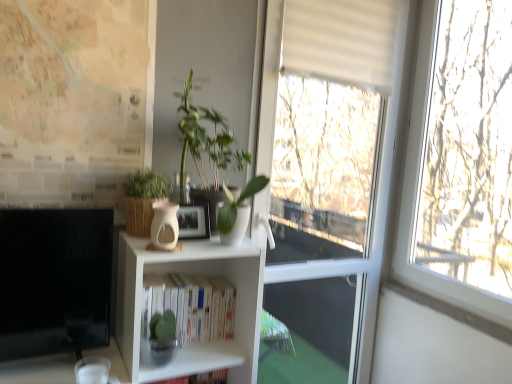
This screenshot has width=512, height=384. Identify the location of black glossy tv at left. (54, 280).

What is the approximate height of black glossy tv at left?

black glossy tv at left is 48.29 centimeters tall.

Measure the distance between matte beige vase at center and camera.

The distance of matte beige vase at center from camera is 1.21 meters.

Locate an element on the screen. This screenshot has height=384, width=512. matte beige vase at center is located at coordinates (164, 226).

What do you see at coordinates (214, 155) in the screenshot?
I see `green glossy plant at center, the first houseplant from the right` at bounding box center [214, 155].

Find the location of a particular element. The width and height of the screenshot is (512, 384). green glossy plant at center, which appears as the second houseplant when viewed from the left is located at coordinates (214, 155).

This screenshot has width=512, height=384. I want to click on white matte bookshelf at center, so click(x=191, y=305).

The image size is (512, 384). What do you see at coordinates (143, 199) in the screenshot? I see `brown woven basket at center, marked as the 2th houseplant in a right-to-left arrangement` at bounding box center [143, 199].

Identify the location of black glossy tv at left. The image size is (512, 384). (54, 280).

Consider the image. Is black glossy tv at left shorter than green glossy plant at center, the first houseplant from the right?

No, black glossy tv at left is not shorter than green glossy plant at center, the first houseplant from the right.

From the image's perspective, is black glossy tv at left located beneath green glossy plant at center, which appears as the second houseplant when viewed from the left?

Correct, black glossy tv at left appears lower than green glossy plant at center, which appears as the second houseplant when viewed from the left, in the image.

Does point (89, 221) appear closer or farther from the camera than point (210, 118)?

Clearly, point (89, 221) is closer to the camera than point (210, 118).

Considering the sizes of objects black glossy tv at left and green glossy plant at center, the first houseplant from the right, in the image provided, who is bigger, black glossy tv at left or green glossy plant at center, the first houseplant from the right,?

green glossy plant at center, the first houseplant from the right.

From the image's perspective, is brown woven basket at center, placed as the 1th houseplant when sorted from left to right, above or below matte beige vase at center?

Based on their image positions, brown woven basket at center, placed as the 1th houseplant when sorted from left to right, is located above matte beige vase at center.

Does brown woven basket at center, placed as the 1th houseplant when sorted from left to right, come behind matte beige vase at center?

Yes.

From a real-world perspective, does brown woven basket at center, placed as the 1th houseplant when sorted from left to right, sit lower than matte beige vase at center?

Incorrect, from a real-world perspective, brown woven basket at center, placed as the 1th houseplant when sorted from left to right, is higher than matte beige vase at center.

Can you confirm if brown woven basket at center, placed as the 1th houseplant when sorted from left to right, is positioned to the right of matte beige vase at center?

In fact, brown woven basket at center, placed as the 1th houseplant when sorted from left to right, is to the left of matte beige vase at center.

Which is farther from the camera, (137, 192) or (231, 202)?

The point (137, 192) is farther from the camera.

Considering the relative sizes of brown woven basket at center, marked as the 2th houseplant in a right-to-left arrangement, and white glossy vase at center, which is the second plant in left-to-right order, in the image provided, is brown woven basket at center, marked as the 2th houseplant in a right-to-left arrangement, smaller than white glossy vase at center, which is the second plant in left-to-right order,?

Incorrect, brown woven basket at center, marked as the 2th houseplant in a right-to-left arrangement, is not smaller in size than white glossy vase at center, which is the second plant in left-to-right order.

Could you tell me if green leafy plant at center, arranged as the second plant when viewed from the right, is facing white glossy vase at center, which is the second plant in left-to-right order?

No, green leafy plant at center, arranged as the second plant when viewed from the right, is not turned towards white glossy vase at center, which is the second plant in left-to-right order.

Between green leafy plant at center, which is the first plant from left to right, and white glossy vase at center, which is the first plant from right to left, which one has more height?

green leafy plant at center, which is the first plant from left to right, is taller.

In terms of width, does green leafy plant at center, which is the first plant from left to right, look wider or thinner when compared to white glossy vase at center, which is the first plant from right to left?

Considering their sizes, green leafy plant at center, which is the first plant from left to right, looks broader than white glossy vase at center, which is the first plant from right to left.

Does point (188, 90) appear closer or farther from the camera than point (231, 198)?

Point (188, 90) is closer to the camera than point (231, 198).

Can you confirm if brown woven basket at center, marked as the 2th houseplant in a right-to-left arrangement, is shorter than white matte bookshelf at center?

Correct, brown woven basket at center, marked as the 2th houseplant in a right-to-left arrangement, is not as tall as white matte bookshelf at center.

From a real-world perspective, who is located higher, brown woven basket at center, marked as the 2th houseplant in a right-to-left arrangement, or white matte bookshelf at center?

In real-world perspective, brown woven basket at center, marked as the 2th houseplant in a right-to-left arrangement, is above.

Considering the sizes of objects brown woven basket at center, marked as the 2th houseplant in a right-to-left arrangement, and white matte bookshelf at center in the image provided, who is wider, brown woven basket at center, marked as the 2th houseplant in a right-to-left arrangement, or white matte bookshelf at center?

brown woven basket at center, marked as the 2th houseplant in a right-to-left arrangement.

Does point (144, 218) lie in front of point (189, 275)?

Yes, point (144, 218) is in front of point (189, 275).

Considering the relative sizes of white matte window at center and white glossy vase at center, which is the first plant from right to left, in the image provided, is white matte window at center smaller than white glossy vase at center, which is the first plant from right to left,?

No, white matte window at center is not smaller than white glossy vase at center, which is the first plant from right to left.

Find the location of a particular element. The width and height of the screenshot is (512, 384). window lying on the right of white glossy vase at center, which is the first plant from right to left is located at coordinates (x=328, y=177).

Is there a large distance between white matte window at center and white glossy vase at center, which is the first plant from right to left?

white matte window at center is far away from white glossy vase at center, which is the first plant from right to left.

Is black glossy tv at left far from green leafy plant at center, arranged as the second plant when viewed from the right?

No, black glossy tv at left is in close proximity to green leafy plant at center, arranged as the second plant when viewed from the right.

What's the angular difference between black glossy tv at left and green leafy plant at center, which is the first plant from left to right,'s facing directions?

4.77 degrees.

Who is smaller, black glossy tv at left or green leafy plant at center, which is the first plant from left to right?

Smaller between the two is green leafy plant at center, which is the first plant from left to right.

You are a GUI agent. You are given a task and a screenshot of the screen. Output one action in this format:
    pyautogui.click(x=<x>, y=<y>)
    Task: Click on the window screen on the left side of green glossy plant at center, the first houseplant from the right
    
    Given the screenshot: What is the action you would take?
    pyautogui.click(x=54, y=280)

There is a matte beige vase at center. Where is `the 1st houseplant above it (from a real-world perspective)`? Image resolution: width=512 pixels, height=384 pixels. the 1st houseplant above it (from a real-world perspective) is located at coordinates (143, 199).

Which object lies further to the anchor point green leafy plant at center, arranged as the second plant when viewed from the right, white matte window at center or matte beige vase at center?

Among the two, white matte window at center is located further to green leafy plant at center, arranged as the second plant when viewed from the right.

From the image, which object appears to be farther from white glossy vase at center, which is the first plant from right to left, white matte bookshelf at center or green glossy plant at center, the first houseplant from the right?

Among the two, white matte bookshelf at center is located further to white glossy vase at center, which is the first plant from right to left.

From the image, which object appears to be nearer to green leafy plant at center, which is the first plant from left to right, map paper at left or black glossy tv at left?

map paper at left is closer to green leafy plant at center, which is the first plant from left to right.

Considering their positions, is green leafy plant at center, arranged as the second plant when viewed from the right, positioned further to black glossy tv at left than white matte window at center?

white matte window at center is positioned further to the anchor black glossy tv at left.

Estimate the real-world distances between objects in this image. Which object is closer to map paper at left, black glossy tv at left or white glossy vase at center, which is the second plant in left-to-right order?

black glossy tv at left is closer to map paper at left.

Estimate the real-world distances between objects in this image. Which object is closer to white glossy vase at center, which is the second plant in left-to-right order, green leafy plant at center, which is the first plant from left to right, or map paper at left?

green leafy plant at center, which is the first plant from left to right.

Looking at the image, which one is located closer to green glossy plant at center, the first houseplant from the right, white matte bookshelf at center or black glossy tv at left?

Among the two, white matte bookshelf at center is located nearer to green glossy plant at center, the first houseplant from the right.

From the image, which object appears to be nearer to white glossy vase at center, which is the second plant in left-to-right order, white matte window at center or brown woven basket at center, marked as the 2th houseplant in a right-to-left arrangement?

brown woven basket at center, marked as the 2th houseplant in a right-to-left arrangement.

Find the location of a particular element. The height and width of the screenshot is (384, 512). plant between map paper at left and green glossy plant at center, the first houseplant from the right, in the horizontal direction is located at coordinates (188, 128).

Identify the location of plant between brown woven basket at center, placed as the 1th houseplant when sorted from left to right, and white glossy vase at center, which is the second plant in left-to-right order. The height and width of the screenshot is (384, 512). (188, 128).

Identify the location of window screen that lies between green glossy plant at center, which appears as the second houseplant when viewed from the left, and white matte bookshelf at center from top to bottom. (54, 280).

At what (x,y) coordinates should I click in order to perform the action: click on vase between black glossy tv at left and white matte bookshelf at center in the horizontal direction. Please return your answer as a coordinate pair (x, y). The image size is (512, 384). Looking at the image, I should click on [x=164, y=226].